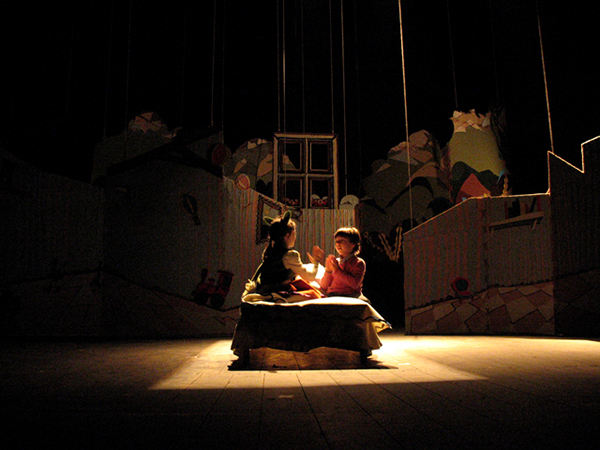
I want to click on box, so click(x=488, y=302).